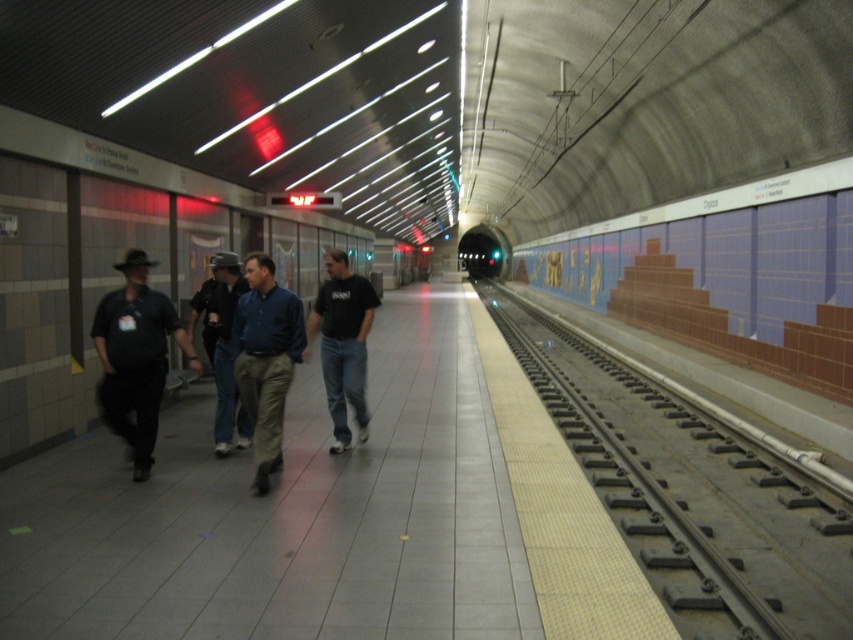
Which is below, black metal track at right or matte blue shirt at center?

Positioned lower is black metal track at right.

Is point (706, 596) farther from viewer compared to point (250, 342)?

That is False.

Where is `black metal track at right`? The height and width of the screenshot is (640, 853). black metal track at right is located at coordinates (691, 493).

Does matte blue shirt at center appear over black matte shirt at center?

Actually, matte blue shirt at center is below black matte shirt at center.

Which of these two, matte blue shirt at center or black matte shirt at center, stands shorter?

Standing shorter between the two is matte blue shirt at center.

Identify the location of matte blue shirt at center. This screenshot has height=640, width=853. (265, 358).

Who is shorter, matte black shirt at left or blue shirt at center?

Standing shorter between the two is matte black shirt at left.

Can you confirm if matte black shirt at left is positioned below blue shirt at center?

Correct, matte black shirt at left is located below blue shirt at center.

The height and width of the screenshot is (640, 853). I want to click on matte black shirt at left, so click(x=135, y=356).